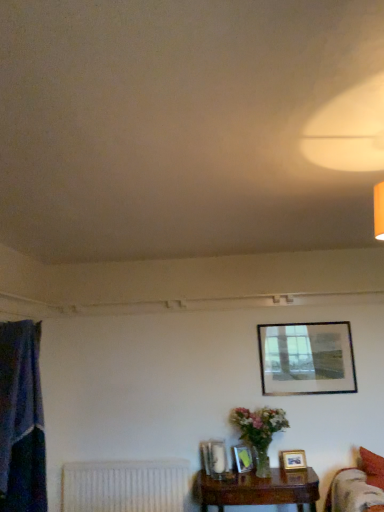
Where is `matte plastic picture frame at lower center, placed as the fourth picture frame when sorted from top to bottom`? The width and height of the screenshot is (384, 512). matte plastic picture frame at lower center, placed as the fourth picture frame when sorted from top to bottom is located at coordinates (243, 458).

Measure the distance between point (177, 480) and camera.

Point (177, 480) and camera are 3.73 meters apart.

Find the location of `white textured radiator at lower left`. white textured radiator at lower left is located at coordinates (124, 486).

The width and height of the screenshot is (384, 512). What do you see at coordinates (306, 358) in the screenshot?
I see `metallic silver picture frame at upper center, arranged as the fourth picture frame when viewed from the left` at bounding box center [306, 358].

Where is `blue fabric curtain at left`? Image resolution: width=384 pixels, height=512 pixels. blue fabric curtain at left is located at coordinates (21, 420).

Considering the points (358, 476) and (81, 497), which point is behind, point (358, 476) or point (81, 497)?

The point (81, 497) is more distant.

Is velvet red couch at lower right directly adjacent to white textured radiator at lower left?

No, velvet red couch at lower right is not making contact with white textured radiator at lower left.

In the scene shown: Is velvet red couch at lower right positioned with its back to white textured radiator at lower left?

Correct, velvet red couch at lower right is looking away from white textured radiator at lower left.

Considering the sizes of objects velvet red couch at lower right and white textured radiator at lower left in the image provided, who is smaller, velvet red couch at lower right or white textured radiator at lower left?

white textured radiator at lower left.

From the image's perspective, does metallic silver picture frame at upper center, which appears as the fourth picture frame when ordered from the bottom, appear lower than matte plastic picture frame at lower center, placed as the fourth picture frame when sorted from top to bottom?

Incorrect, from the image's perspective, metallic silver picture frame at upper center, which appears as the fourth picture frame when ordered from the bottom, is higher than matte plastic picture frame at lower center, placed as the fourth picture frame when sorted from top to bottom.

How different are the orientations of metallic silver picture frame at upper center, arranged as the fourth picture frame when viewed from the left, and matte plastic picture frame at lower center, which is the second picture frame from left to right, in degrees?

30.8 degrees separate the facing orientations of metallic silver picture frame at upper center, arranged as the fourth picture frame when viewed from the left, and matte plastic picture frame at lower center, which is the second picture frame from left to right.

Do you think metallic silver picture frame at upper center, the first picture frame when ordered from top to bottom, is within matte plastic picture frame at lower center, placed as the fourth picture frame when sorted from top to bottom, or outside of it?

metallic silver picture frame at upper center, the first picture frame when ordered from top to bottom, is spatially situated outside matte plastic picture frame at lower center, placed as the fourth picture frame when sorted from top to bottom.

In terms of size, does metallic silver picture frame at upper center, which appears as the fourth picture frame when ordered from the bottom, appear bigger or smaller than matte plastic picture frame at lower center, placed as the fourth picture frame when sorted from top to bottom?

Clearly, metallic silver picture frame at upper center, which appears as the fourth picture frame when ordered from the bottom, is larger in size than matte plastic picture frame at lower center, placed as the fourth picture frame when sorted from top to bottom.

Considering the positions of objects white textured radiator at lower left and matte glass picture frame at lower center, which ranks as the 2th picture frame in top-to-bottom order, in the image provided, who is more to the right, white textured radiator at lower left or matte glass picture frame at lower center, which ranks as the 2th picture frame in top-to-bottom order,?

matte glass picture frame at lower center, which ranks as the 2th picture frame in top-to-bottom order.

Could you measure the distance between white textured radiator at lower left and matte glass picture frame at lower center, placed as the 4th picture frame when sorted from right to left?

white textured radiator at lower left and matte glass picture frame at lower center, placed as the 4th picture frame when sorted from right to left, are 25.85 inches apart from each other.

Considering the sizes of white textured radiator at lower left and matte glass picture frame at lower center, acting as the 1th picture frame starting from the left, in the image, is white textured radiator at lower left wider or thinner than matte glass picture frame at lower center, acting as the 1th picture frame starting from the left,?

In the image, white textured radiator at lower left appears to be wider than matte glass picture frame at lower center, acting as the 1th picture frame starting from the left.

Considering the relative positions of white textured radiator at lower left and matte glass picture frame at lower center, placed as the 4th picture frame when sorted from right to left, in the image provided, is white textured radiator at lower left in front of matte glass picture frame at lower center, placed as the 4th picture frame when sorted from right to left,?

That is False.

What's the angular difference between matte glass picture frame at lower center, placed as the 4th picture frame when sorted from right to left, and blue fabric curtain at left's facing directions?

111 degrees separate the facing orientations of matte glass picture frame at lower center, placed as the 4th picture frame when sorted from right to left, and blue fabric curtain at left.

Considering the relative sizes of matte glass picture frame at lower center, which is counted as the 3th picture frame, starting from the bottom, and blue fabric curtain at left in the image provided, is matte glass picture frame at lower center, which is counted as the 3th picture frame, starting from the bottom, smaller than blue fabric curtain at left?

Yes, matte glass picture frame at lower center, which is counted as the 3th picture frame, starting from the bottom, is smaller than blue fabric curtain at left.

Who is more distant, matte glass picture frame at lower center, placed as the 4th picture frame when sorted from right to left, or blue fabric curtain at left?

matte glass picture frame at lower center, placed as the 4th picture frame when sorted from right to left, is behind.

In the scene shown: Are matte glass picture frame at lower center, which ranks as the 2th picture frame in top-to-bottom order, and blue fabric curtain at left located far from each other?

Yes, matte glass picture frame at lower center, which ranks as the 2th picture frame in top-to-bottom order, and blue fabric curtain at left are quite far apart.

Where is `curtain that is on the left side of matte plastic picture frame at lower center, acting as the first picture frame starting from the bottom`? curtain that is on the left side of matte plastic picture frame at lower center, acting as the first picture frame starting from the bottom is located at coordinates (21, 420).

What's the angular difference between blue fabric curtain at left and matte plastic picture frame at lower center, placed as the fourth picture frame when sorted from top to bottom,'s facing directions?

103 degrees.

From the image's perspective, is blue fabric curtain at left located above or below matte plastic picture frame at lower center, placed as the fourth picture frame when sorted from top to bottom?

blue fabric curtain at left is above matte plastic picture frame at lower center, placed as the fourth picture frame when sorted from top to bottom.

Would you say wooden photo frame at lower right, positioned as the 3th picture frame in top-to-bottom order, is inside or outside matte plastic picture frame at lower center, the 3th picture frame when ordered from right to left?

wooden photo frame at lower right, positioned as the 3th picture frame in top-to-bottom order, is not inside matte plastic picture frame at lower center, the 3th picture frame when ordered from right to left, it's outside.

Consider the image. In the image, is wooden photo frame at lower right, which ranks as the second picture frame in right-to-left order, on the left side or the right side of matte plastic picture frame at lower center, acting as the first picture frame starting from the bottom?

From the image, it's evident that wooden photo frame at lower right, which ranks as the second picture frame in right-to-left order, is to the right of matte plastic picture frame at lower center, acting as the first picture frame starting from the bottom.

Between wooden photo frame at lower right, which ranks as the second picture frame in right-to-left order, and matte plastic picture frame at lower center, the 3th picture frame when ordered from right to left, which one has less height?

With less height is wooden photo frame at lower right, which ranks as the second picture frame in right-to-left order.

Locate an element on the screen. the 1st picture frame behind the wooden photo frame at lower right, which ranks as the second picture frame in right-to-left order is located at coordinates [243, 458].

Can you confirm if matte plastic picture frame at lower center, placed as the fourth picture frame when sorted from top to bottom, is wider than wooden photo frame at lower right, the 3th picture frame positioned from the left?

Yes.

Which object is closer to the camera taking this photo, matte plastic picture frame at lower center, acting as the first picture frame starting from the bottom, or wooden photo frame at lower right, the 3th picture frame positioned from the left?

wooden photo frame at lower right, the 3th picture frame positioned from the left.

At what (x,y) coordinates should I click in order to perform the action: click on couch in front of the white textured radiator at lower left. Please return your answer as a coordinate pair (x, y). Looking at the image, I should click on (358, 486).

Starting from the matte plastic picture frame at lower center, the 3th picture frame when ordered from right to left, which picture frame is the 2nd one to the right? Please provide its 2D coordinates.

[(306, 358)]

Considering their positions, is velvet red couch at lower right positioned further to matte glass picture frame at lower center, which ranks as the 2th picture frame in top-to-bottom order, than wooden photo frame at lower right, which ranks as the second picture frame in right-to-left order?

velvet red couch at lower right is positioned further to the anchor matte glass picture frame at lower center, which ranks as the 2th picture frame in top-to-bottom order.

Estimate the real-world distances between objects in this image. Which object is further from velvet red couch at lower right, metallic silver picture frame at upper center, placed as the first picture frame when sorted from right to left, or matte plastic picture frame at lower center, the 3th picture frame when ordered from right to left?

metallic silver picture frame at upper center, placed as the first picture frame when sorted from right to left.

When comparing their distances from blue fabric curtain at left, does brown wooden table at lower right or matte plastic picture frame at lower center, the 3th picture frame when ordered from right to left, seem closer?

Based on the image, brown wooden table at lower right appears to be nearer to blue fabric curtain at left.

From the image, which object appears to be nearer to matte glass picture frame at lower center, which is counted as the 3th picture frame, starting from the bottom, wooden photo frame at lower right, the 3th picture frame positioned from the left, or metallic silver picture frame at upper center, arranged as the fourth picture frame when viewed from the left?

wooden photo frame at lower right, the 3th picture frame positioned from the left, lies closer to matte glass picture frame at lower center, which is counted as the 3th picture frame, starting from the bottom, than the other object.

Estimate the real-world distances between objects in this image. Which object is closer to velvet red couch at lower right, white textured radiator at lower left or matte plastic picture frame at lower center, which is the second picture frame from left to right?

matte plastic picture frame at lower center, which is the second picture frame from left to right.

From the image, which object appears to be farther from matte glass picture frame at lower center, placed as the 4th picture frame when sorted from right to left, metallic silver picture frame at upper center, which appears as the fourth picture frame when ordered from the bottom, or wooden photo frame at lower right, which ranks as the second picture frame in right-to-left order?

Among the two, metallic silver picture frame at upper center, which appears as the fourth picture frame when ordered from the bottom, is located further to matte glass picture frame at lower center, placed as the 4th picture frame when sorted from right to left.

Looking at the image, which one is located closer to blue fabric curtain at left, wooden photo frame at lower right, the 3th picture frame positioned from the left, or white textured radiator at lower left?

Among the two, white textured radiator at lower left is located nearer to blue fabric curtain at left.

From the image, which object appears to be nearer to white textured radiator at lower left, wooden photo frame at lower right, the 3th picture frame positioned from the left, or brown wooden table at lower right?

brown wooden table at lower right.

Locate an element on the screen. radiator between blue fabric curtain at left and matte plastic picture frame at lower center, which is the second picture frame from left to right, in the front-back direction is located at coordinates (124, 486).

This screenshot has height=512, width=384. In order to click on radiator between blue fabric curtain at left and wooden photo frame at lower right, positioned as the 3th picture frame in top-to-bottom order, from left to right in this screenshot , I will do `click(124, 486)`.

Find the location of `picture frame between metallic silver picture frame at upper center, arranged as the fourth picture frame when viewed from the left, and wooden photo frame at lower right, the 3th picture frame positioned from the left, vertically`. picture frame between metallic silver picture frame at upper center, arranged as the fourth picture frame when viewed from the left, and wooden photo frame at lower right, the 3th picture frame positioned from the left, vertically is located at coordinates (214, 458).

Locate an element on the screen. The height and width of the screenshot is (512, 384). table between matte glass picture frame at lower center, placed as the 4th picture frame when sorted from right to left, and wooden photo frame at lower right, which ranks as the second picture frame in right-to-left order is located at coordinates (258, 489).